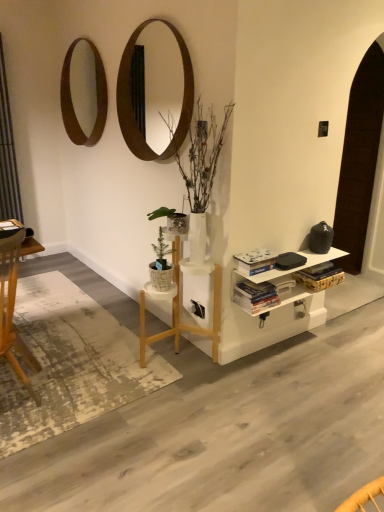
The width and height of the screenshot is (384, 512). In order to click on vacant space situated above hardcover books at center, the second book positioned from the top (from a real-world perspective) in this screenshot , I will do `click(253, 283)`.